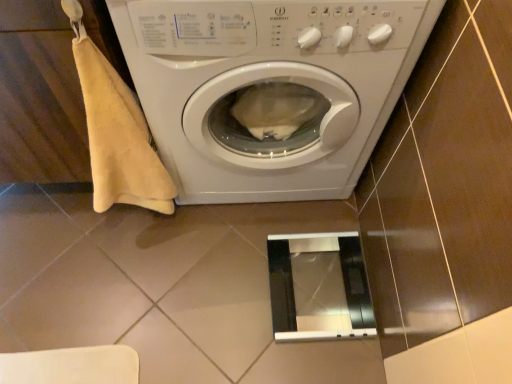
Where is `free space in front of metallic silver screen door at lower center`? The width and height of the screenshot is (512, 384). free space in front of metallic silver screen door at lower center is located at coordinates (313, 359).